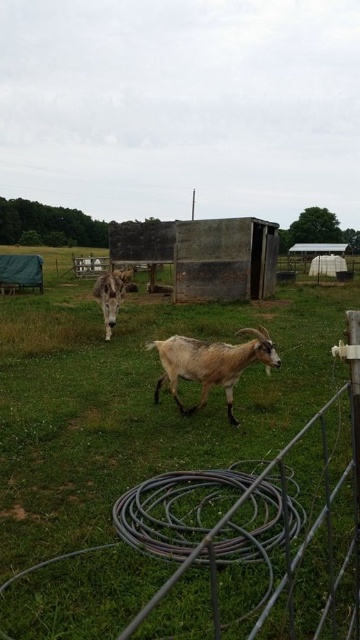
Does brown fuzzy goat at center appear on the right side of brown woolen goat at center?

Indeed, brown fuzzy goat at center is positioned on the right side of brown woolen goat at center.

This screenshot has width=360, height=640. I want to click on brown fuzzy goat at center, so click(x=210, y=364).

Where is `brown fuzzy goat at center`? This screenshot has height=640, width=360. brown fuzzy goat at center is located at coordinates (210, 364).

Between point (86, 518) and point (190, 376), which one is positioned in front?

Point (86, 518) is more forward.

Which is behind, point (258, 609) or point (203, 360)?

The point (203, 360) is more distant.

This screenshot has width=360, height=640. In order to click on green grassy field at center in this screenshot , I will do `click(181, 490)`.

Measure the distance between green grassy field at center and camera.

green grassy field at center is 75.68 centimeters from camera.

In the scene shown: Is green grassy field at center positioned before brown woolen goat at center?

Yes, green grassy field at center is in front of brown woolen goat at center.

Find the location of a particular element. The width and height of the screenshot is (360, 640). green grassy field at center is located at coordinates (181, 490).